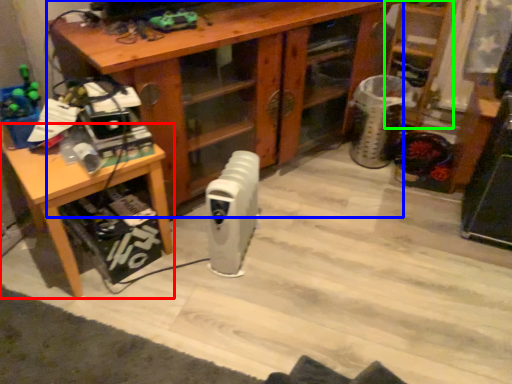
Question: Estimate the real-world distances between objects in this image. Which object is farther from table (highlighted by a red box), desk (highlighted by a blue box) or shelf (highlighted by a green box)?

Choices:
 (A) desk
 (B) shelf

Answer: (B)